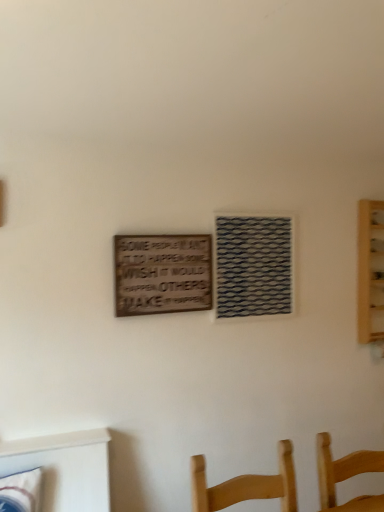
Locate an element on the screen. wooden sign at center is located at coordinates point(162,274).

Describe the element at coordinates (162, 274) in the screenshot. I see `wooden sign at center` at that location.

Locate an element on the screen. woven fabric window at center is located at coordinates (253, 266).

What do you see at coordinates (253, 266) in the screenshot?
I see `woven fabric window at center` at bounding box center [253, 266].

The image size is (384, 512). I want to click on wooden sign at center, so pos(162,274).

Is woven fabric window at center at the left side of wooden sign at center?

Incorrect, woven fabric window at center is not on the left side of wooden sign at center.

Which is behind, woven fabric window at center or wooden sign at center?

Positioned behind is woven fabric window at center.

Does point (238, 270) appear closer or farther from the camera than point (181, 284)?

Point (238, 270) appears to be farther away from the viewer than point (181, 284).

From the image's perspective, is woven fabric window at center on wooden sign at center?

Yes.

From a real-world perspective, is woven fabric window at center physically below wooden sign at center?

No, from a real-world perspective, woven fabric window at center is not below wooden sign at center.

Is woven fabric window at center thinner than wooden sign at center?

In fact, woven fabric window at center might be wider than wooden sign at center.

Does woven fabric window at center have a lesser height compared to wooden sign at center?

No.

Considering the relative sizes of woven fabric window at center and wooden sign at center in the image provided, is woven fabric window at center smaller than wooden sign at center?

No.

Can we say woven fabric window at center lies outside wooden sign at center?

Yes.

Is there a large distance between woven fabric window at center and wooden sign at center?

No, there isn't a large distance between woven fabric window at center and wooden sign at center.

Is woven fabric window at center positioned with its back to wooden sign at center?

No, woven fabric window at center is not facing the opposite direction of wooden sign at center.

In the scene shown: Can you tell me how much woven fabric window at center and wooden sign at center differ in facing direction?

The angle between the facing direction of woven fabric window at center and the facing direction of wooden sign at center is 0.0138 degrees.

Find the location of a particular element. This screenshot has width=384, height=512. window on the right side of wooden sign at center is located at coordinates (253, 266).

Is wooden sign at center at the left side of woven fabric window at center?

Indeed, wooden sign at center is positioned on the left side of woven fabric window at center.

Is wooden sign at center in front of woven fabric window at center?

Yes.

Is point (177, 263) farther from viewer compared to point (282, 275)?

No, (177, 263) is closer to viewer.

From the image's perspective, is wooden sign at center under woven fabric window at center?

Indeed, from the image's perspective, wooden sign at center is shown beneath woven fabric window at center.

From a real-world perspective, who is located lower, wooden sign at center or woven fabric window at center?

From a 3D spatial view, wooden sign at center is below.

Which of these two, wooden sign at center or woven fabric window at center, is wider?

Wider between the two is woven fabric window at center.

Between wooden sign at center and woven fabric window at center, which one has more height?

woven fabric window at center is taller.

Considering the sizes of objects wooden sign at center and woven fabric window at center in the image provided, who is bigger, wooden sign at center or woven fabric window at center?

With larger size is woven fabric window at center.

Looking at this image, is wooden sign at center not within woven fabric window at center?

wooden sign at center lies outside woven fabric window at center's area.

Would you consider wooden sign at center to be distant from woven fabric window at center?

No, wooden sign at center is in close proximity to woven fabric window at center.

Is wooden sign at center positioned with its back to woven fabric window at center?

wooden sign at center is not turned away from woven fabric window at center.

What's the angular difference between wooden sign at center and woven fabric window at center's facing directions?

wooden sign at center and woven fabric window at center are facing 0.0138 degrees away from each other.

Based on the photo, how much distance is there between wooden sign at center and woven fabric window at center?

wooden sign at center and woven fabric window at center are 11.60 inches apart from each other.

The width and height of the screenshot is (384, 512). In the image, there is a wooden sign at center. What are the coordinates of `window above it (from the image's perspective)` in the screenshot? It's located at (253, 266).

This screenshot has width=384, height=512. What are the coordinates of `plaque that appears below the woven fabric window at center (from a real-world perspective)` in the screenshot? It's located at (162, 274).

You are a GUI agent. You are given a task and a screenshot of the screen. Output one action in this format:
    pyautogui.click(x=<x>, y=<y>)
    Task: Click on the window on the right of wooden sign at center
    
    Given the screenshot: What is the action you would take?
    pyautogui.click(x=253, y=266)